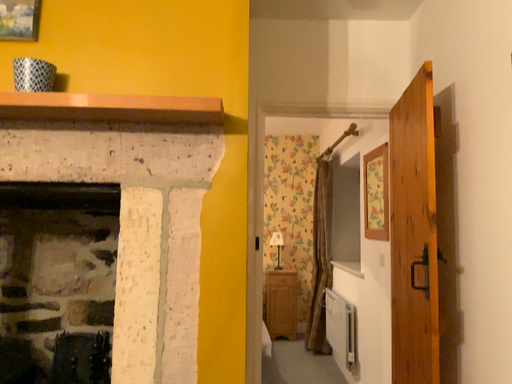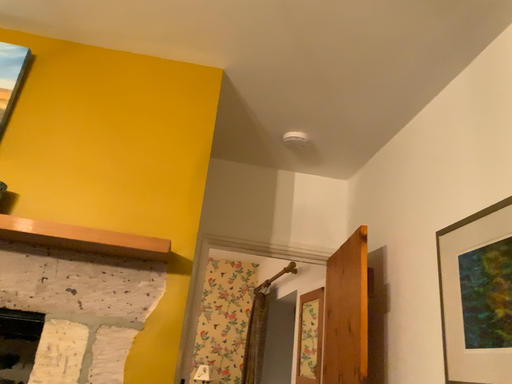
Question: Which way did the camera rotate in the video?

Choices:
 (A) rotated downward
 (B) rotated upward

Answer: (B)